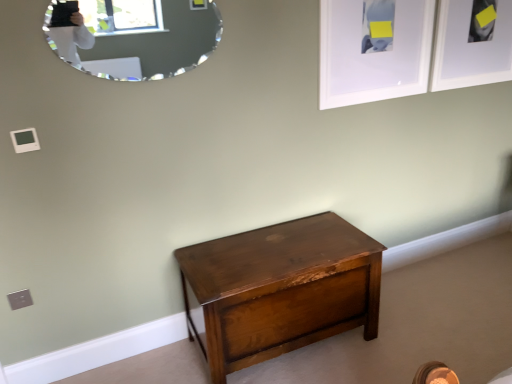
Image resolution: width=512 pixels, height=384 pixels. In order to click on vacant area that is situated to the right of shiny brown wood chest at center in this screenshot , I will do pyautogui.click(x=414, y=330).